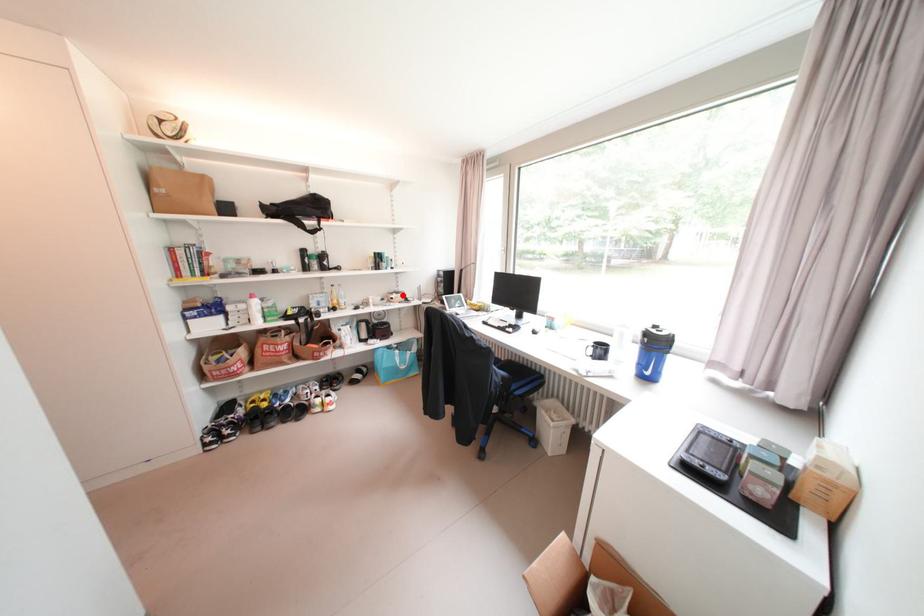
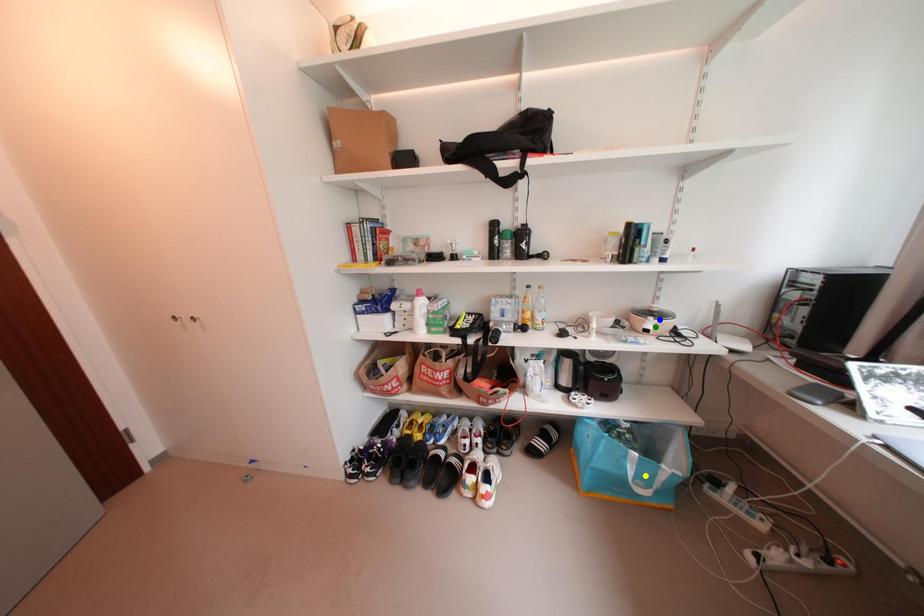
Question: I am providing you with two images of the same scene from different viewpoints. A red point is marked on the first image. You are given multiple points on the second image. Which point in image 2 is actually the same real-world point as the red point in image 1?

Choices:
 (A) blue point
 (B) yellow point
 (C) green point

Answer: (A)